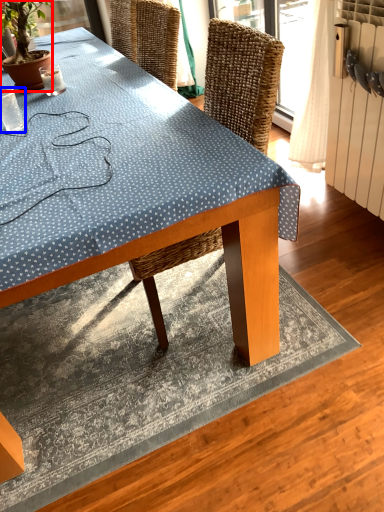
Question: Which of the following is the closest to the observer, houseplant (highlighted by a red box) or coffee cup (highlighted by a blue box)?

Choices:
 (A) houseplant
 (B) coffee cup

Answer: (B)